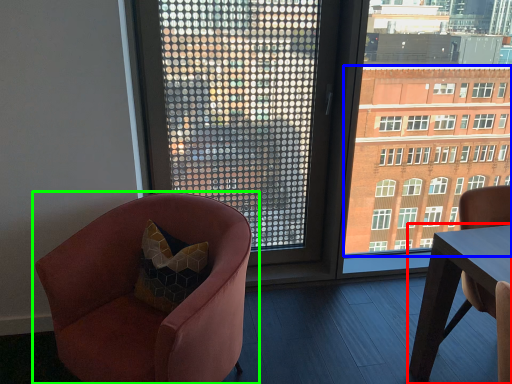
Question: Which is nearer to the table (highlighted by a red box)? condominium (highlighted by a blue box) or chair (highlighted by a green box).

Choices:
 (A) condominium
 (B) chair

Answer: (A)